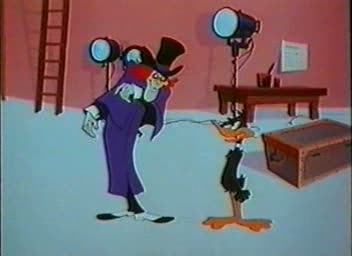
The height and width of the screenshot is (256, 352). Find the location of `ladder`. ladder is located at coordinates (53, 62).